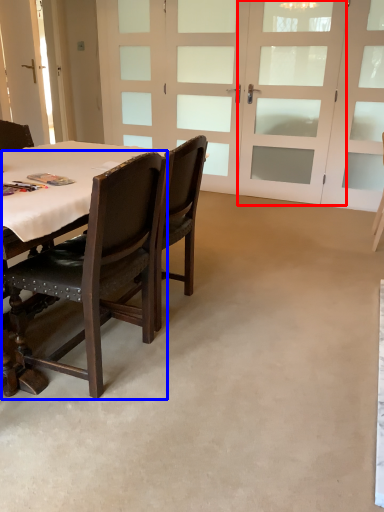
Question: Which object appears closest to the camera in this image, screen door (highlighted by a red box) or chair (highlighted by a blue box)?

Choices:
 (A) screen door
 (B) chair

Answer: (B)